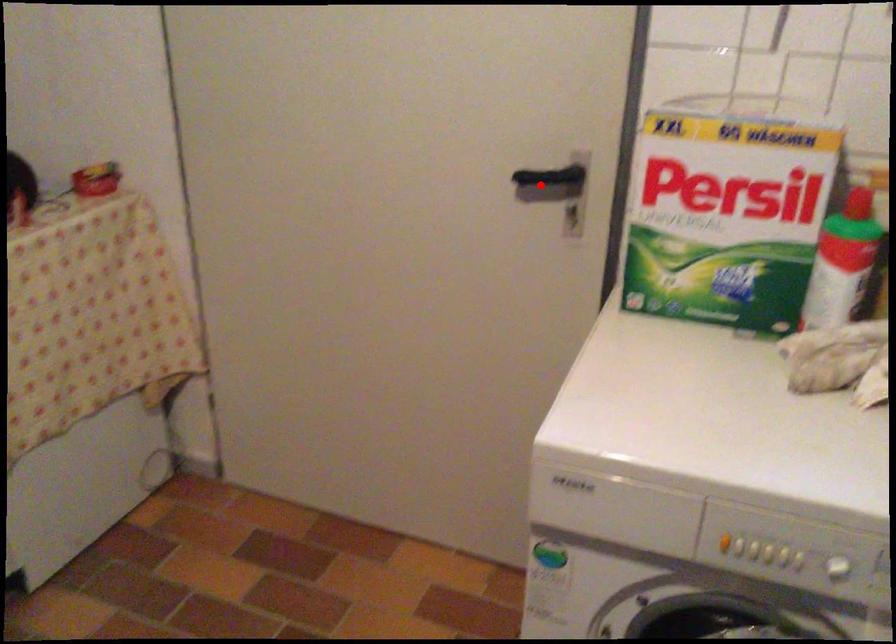
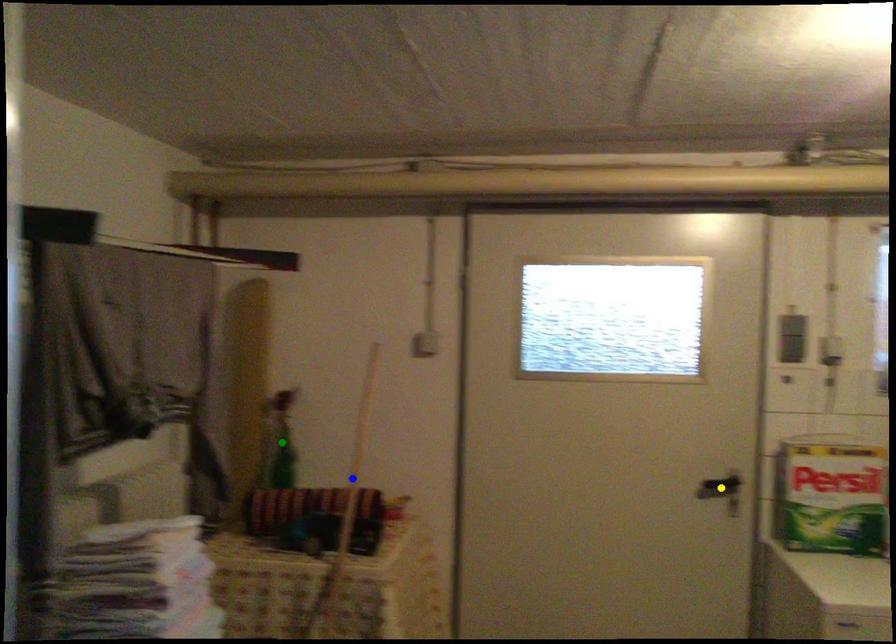
Question: I am providing you with two images of the same scene from different viewpoints. A red point is marked on the first image. You are given multiple points on the second image. Can you choose the point in image 2 that corresponds to the point in image 1?

Choices:
 (A) green point
 (B) yellow point
 (C) blue point

Answer: (B)